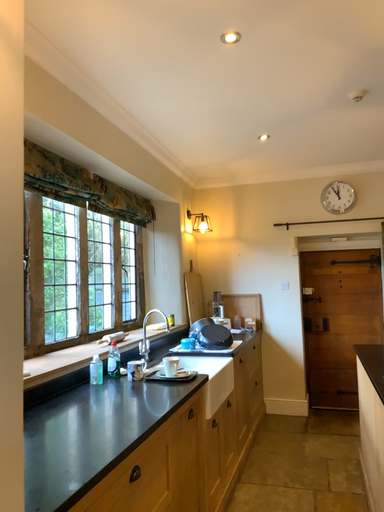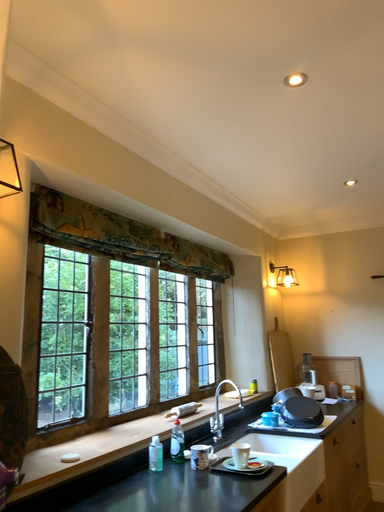
Question: How did the camera likely rotate when shooting the video?

Choices:
 (A) rotated right
 (B) rotated left

Answer: (B)